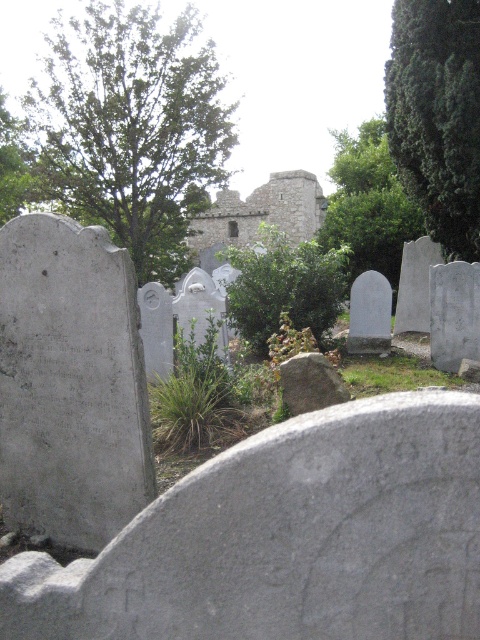
Which is more to the right, green leafy tree at center or gray rough stone at center?

Positioned to the right is green leafy tree at center.

Which is below, green leafy tree at center or gray rough stone at center?

gray rough stone at center is below.

Is point (334, 241) more distant than point (324, 371)?

Yes, point (334, 241) is behind point (324, 371).

The width and height of the screenshot is (480, 640). I want to click on green leafy tree at center, so click(x=369, y=204).

Who is taller, green leafy bush at center or gray rough stone at center?

Standing taller between the two is green leafy bush at center.

Is point (304, 266) closer to viewer compared to point (283, 362)?

That is False.

Where is `green leafy bush at center`? This screenshot has width=480, height=640. green leafy bush at center is located at coordinates (285, 288).

Can you confirm if green leafy tree at upper left is smaller than green leafy bush at center?

Actually, green leafy tree at upper left might be larger than green leafy bush at center.

Who is higher up, green leafy tree at upper left or green leafy bush at center?

green leafy tree at upper left is above.

This screenshot has width=480, height=640. What do you see at coordinates (132, 129) in the screenshot?
I see `green leafy tree at upper left` at bounding box center [132, 129].

Find the location of a particular element. This screenshot has height=640, width=480. green leafy tree at upper left is located at coordinates (132, 129).